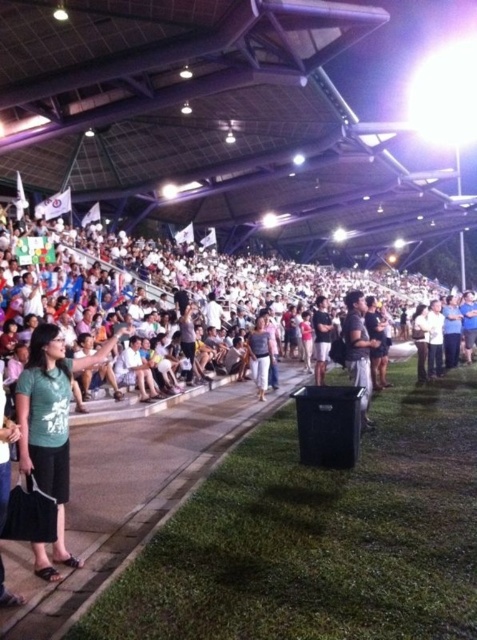
You are standing at the point marked as point [259,355] in the image. What type of clothing item is directly under your feet?

The point [259,355] is on light brown fabric pants at center, so the clothing item directly under your feet is light brown fabric pants.

You are an event organizer checking the attire of participants. You notice a participant wearing a green matte shirt at center and light brown fabric pants at center. Which piece of clothing is closer to the ground?

The light brown fabric pants at center are closer to the ground because the green matte shirt at center is positioned under them.

You are standing at the edge of the grassy area near the black trash bin and want to take a photo of the black fabric shirt at center and light brown fabric pants at center. Which object will appear larger in your photo?

The black fabric shirt at center will appear larger in the photo because it is closer to the viewer than the light brown fabric pants at center.